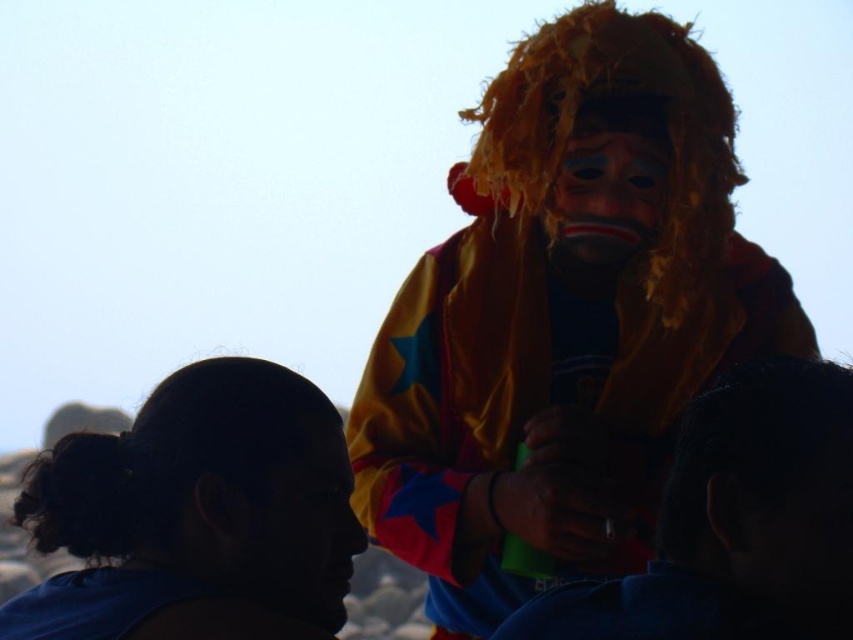
Is blue fabric head at lower left closer to the viewer compared to matte black face at center?

Yes.

Between blue fabric head at lower left and matte black face at center, which one is positioned lower?

Positioned lower is matte black face at center.

Which is behind, point (102, 465) or point (279, 492)?

Point (279, 492)

Locate an element on the screen. The image size is (853, 640). blue fabric head at lower left is located at coordinates (196, 515).

I want to click on yellow fabric lion mask at upper right, so click(563, 316).

Does matte black face at center come behind matte plastic mask at center?

No, it is not.

Does point (273, 595) come farther from viewer compared to point (660, 179)?

No, (273, 595) is in front of (660, 179).

Find the location of `matte black face at center`. matte black face at center is located at coordinates (305, 531).